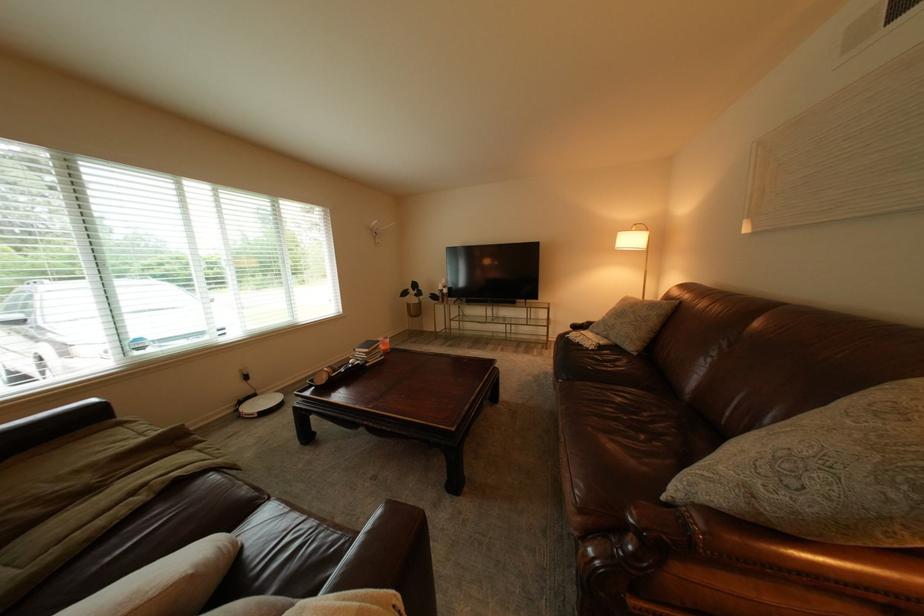
Describe the element at coordinates (412, 299) in the screenshot. Image resolution: width=924 pixels, height=616 pixels. I see `the small potted plant` at that location.